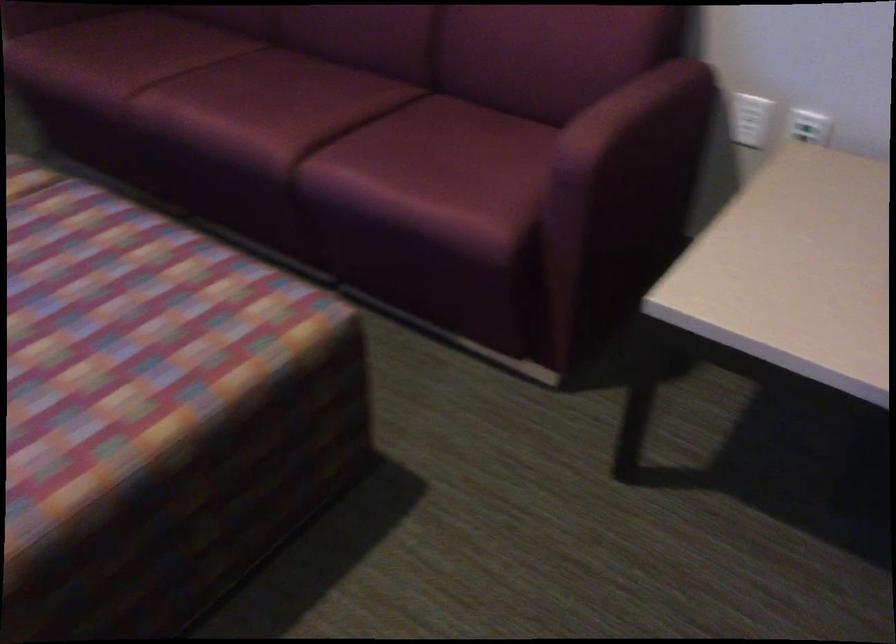
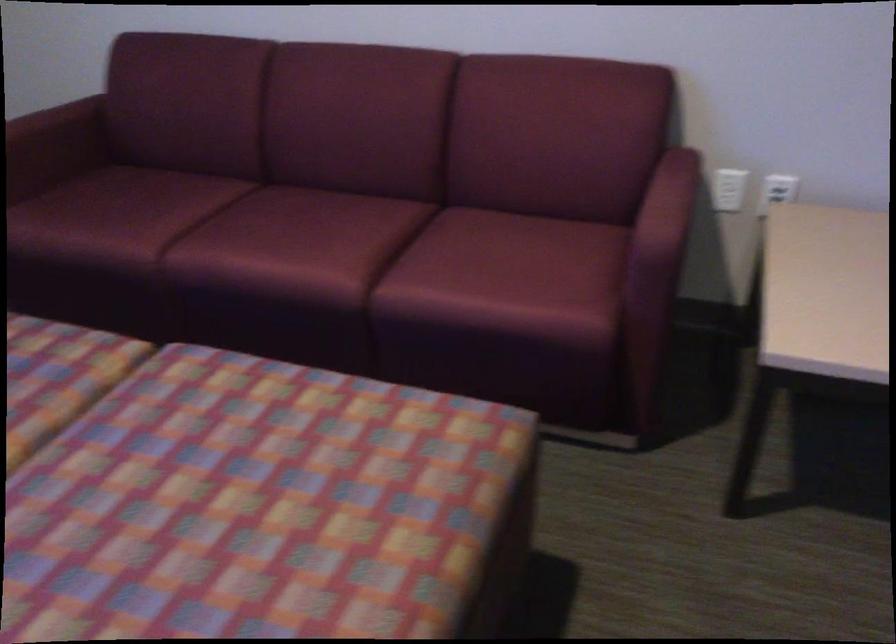
Locate, in the second image, the point that corresponds to [279,117] in the first image.

(332, 249)